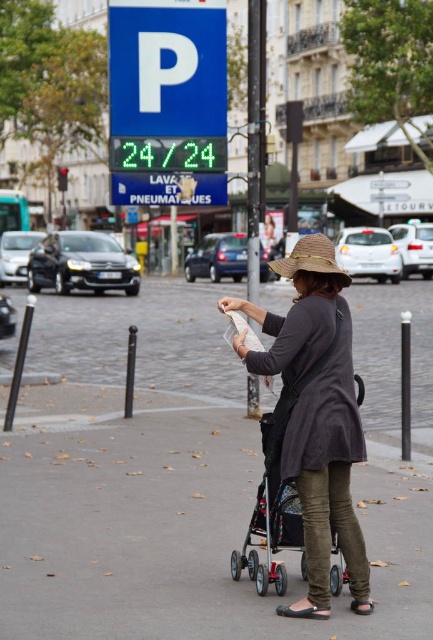
In the scene shown: You are a delivery person who needs to deliver a package to a customer standing near the matte gray coat at center and the metallic silver baby carriage at center. The delivery vehicle can only approach within 1 meter of the customer. Given that the distance between the two objects is 1.2 meters, can the vehicle safely stop without hitting either object?

The distance between the matte gray coat at center and the metallic silver baby carriage at center is 1.2 meters. Since the delivery vehicle needs to stop within 1 meter of the customer, the vehicle can safely stop as 1.2 meters is greater than 1 meter, allowing enough space without hitting either object.

You are a tourist in Paris holding a map and standing near a baby stroller. You see two points marked on your map at coordinates point (293, 566) and point (275, 528). Which point is closer to you?

Point (293, 566) is further to the viewer than point (275, 528), so the closer point to you is point (275, 528).

You are a delivery person who needs to place a small package on the ground in the exact center of the image. The image has a smooth concrete pavement at center located at point (174, 525). Where should you place the package?

You should place the package on the smooth concrete pavement at center located at point (174, 525) since that is the exact center of the image.